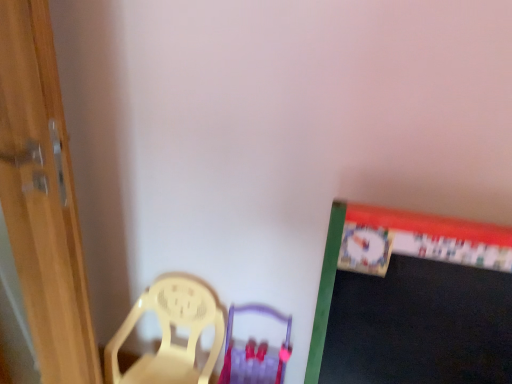
What do you see at coordinates (170, 333) in the screenshot? I see `yellow plastic chair at lower left` at bounding box center [170, 333].

Image resolution: width=512 pixels, height=384 pixels. What do you see at coordinates (42, 197) in the screenshot?
I see `wooden door at left` at bounding box center [42, 197].

Where is `yellow plastic chair at lower left`? The height and width of the screenshot is (384, 512). yellow plastic chair at lower left is located at coordinates (170, 333).

Does wooden door at left turn towards purple plastic armchair at center?

No, wooden door at left is not facing towards purple plastic armchair at center.

Which is less distant, (4, 39) or (222, 373)?

The point (4, 39) is more forward.

Can you see wooden door at left touching purple plastic armchair at center?

No, wooden door at left is not in contact with purple plastic armchair at center.

Based on the photo, what's the angular difference between wooden door at left and purple plastic armchair at center's facing directions?

21.6 degrees separate the facing orientations of wooden door at left and purple plastic armchair at center.

Does yellow plastic chair at lower left touch purple plastic armchair at center?

No, yellow plastic chair at lower left is not making contact with purple plastic armchair at center.

Based on the photo, which object is thinner, yellow plastic chair at lower left or purple plastic armchair at center?

yellow plastic chair at lower left is thinner.

In the image, there is a yellow plastic chair at lower left. Where is `armchair below it (from a real-world perspective)`? The image size is (512, 384). armchair below it (from a real-world perspective) is located at coordinates (255, 353).

How different are the orientations of yellow plastic chair at lower left and purple plastic armchair at center in degrees?

The angle between the facing direction of yellow plastic chair at lower left and the facing direction of purple plastic armchair at center is 1.2 degrees.

Is yellow plastic chair at lower left at the back of purple plastic armchair at center?

purple plastic armchair at center is not turned away from yellow plastic chair at lower left.

Based on the photo, who is taller, purple plastic armchair at center or yellow plastic chair at lower left?

Standing taller between the two is yellow plastic chair at lower left.

Considering the relative sizes of purple plastic armchair at center and yellow plastic chair at lower left in the image provided, is purple plastic armchair at center wider than yellow plastic chair at lower left?

Yes, purple plastic armchair at center is wider than yellow plastic chair at lower left.

Between wooden door at left and yellow plastic chair at lower left, which one has more height?

Standing taller between the two is wooden door at left.

Is yellow plastic chair at lower left a part of wooden door at left?

Definitely not — yellow plastic chair at lower left is not inside wooden door at left.

Does wooden door at left have a lesser width compared to yellow plastic chair at lower left?

Indeed, wooden door at left has a lesser width compared to yellow plastic chair at lower left.

Which object is closer to the camera taking this photo, wooden door at left or yellow plastic chair at lower left?

wooden door at left is more forward.

Is purple plastic armchair at center positioned with its back to wooden door at left?

No, purple plastic armchair at center is not facing the opposite direction of wooden door at left.

Is purple plastic armchair at center further to the viewer compared to wooden door at left?

Yes, it is.

How much distance is there between purple plastic armchair at center and wooden door at left?

A distance of 26.51 inches exists between purple plastic armchair at center and wooden door at left.

Image resolution: width=512 pixels, height=384 pixels. Find the location of `door above the purple plastic armchair at center (from the image's perspective)`. door above the purple plastic armchair at center (from the image's perspective) is located at coordinates (42, 197).

Considering the positions of objects yellow plastic chair at lower left and wooden door at left in the image provided, who is more to the right, yellow plastic chair at lower left or wooden door at left?

yellow plastic chair at lower left is more to the right.

Is yellow plastic chair at lower left not inside wooden door at left?

yellow plastic chair at lower left is positioned outside wooden door at left.

Considering the sizes of objects yellow plastic chair at lower left and wooden door at left in the image provided, who is shorter, yellow plastic chair at lower left or wooden door at left?

Standing shorter between the two is yellow plastic chair at lower left.

Does yellow plastic chair at lower left touch wooden door at left?

No, yellow plastic chair at lower left is not making contact with wooden door at left.

This screenshot has width=512, height=384. I want to click on armchair below the wooden door at left (from the image's perspective), so click(x=255, y=353).

I want to click on chair above the purple plastic armchair at center (from the image's perspective), so pyautogui.click(x=170, y=333).

From the image, which object appears to be nearer to wooden door at left, yellow plastic chair at lower left or purple plastic armchair at center?

Among the two, yellow plastic chair at lower left is located nearer to wooden door at left.

Which object lies further to the anchor point purple plastic armchair at center, wooden door at left or yellow plastic chair at lower left?

The object further to purple plastic armchair at center is wooden door at left.

From the picture: Looking at the image, which one is located further to purple plastic armchair at center, yellow plastic chair at lower left or wooden door at left?

wooden door at left lies further to purple plastic armchair at center than the other object.

From the image, which object appears to be nearer to yellow plastic chair at lower left, wooden door at left or purple plastic armchair at center?

The object closer to yellow plastic chair at lower left is purple plastic armchair at center.

Considering their positions, is purple plastic armchair at center positioned closer to wooden door at left than yellow plastic chair at lower left?

yellow plastic chair at lower left is positioned closer to the anchor wooden door at left.

From the image, which object appears to be farther from yellow plastic chair at lower left, purple plastic armchair at center or wooden door at left?

The object further to yellow plastic chair at lower left is wooden door at left.

Find the location of a particular element. The width and height of the screenshot is (512, 384). chair located between wooden door at left and purple plastic armchair at center in the left-right direction is located at coordinates [170, 333].